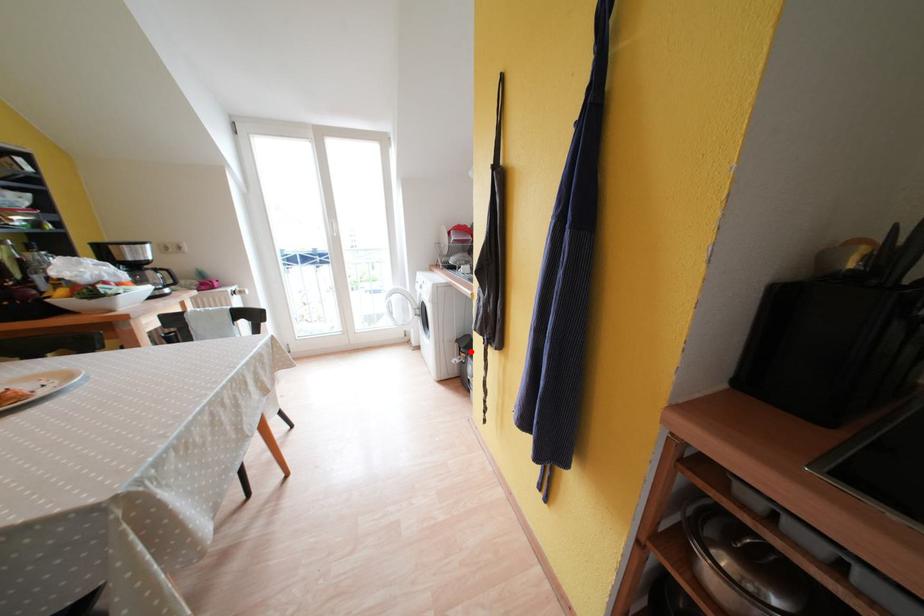
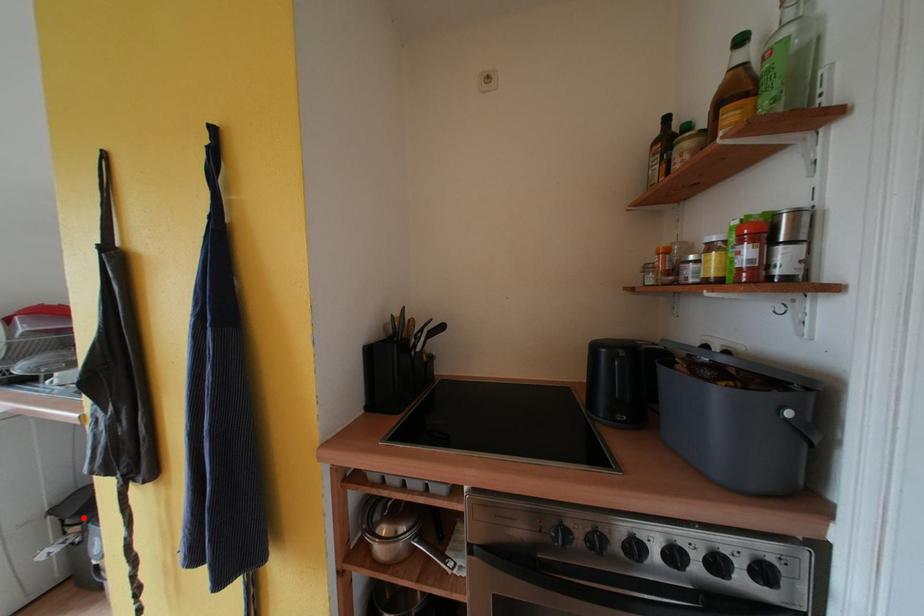
I am providing you with two images of the same scene from different viewpoints. A red point is marked on the first image and another point is marked on the second image. Is the red point in image1 aligned with the point shown in image2?

Yes